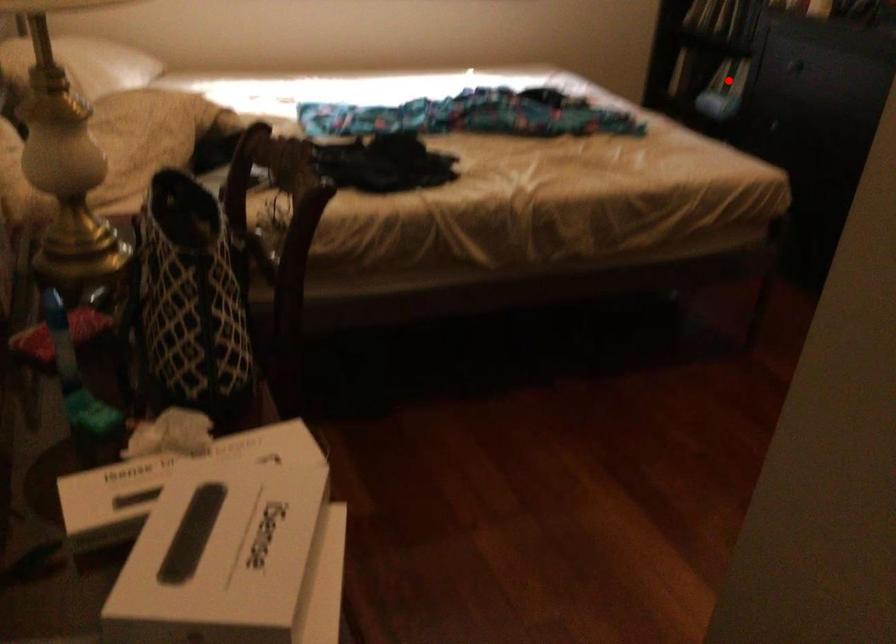
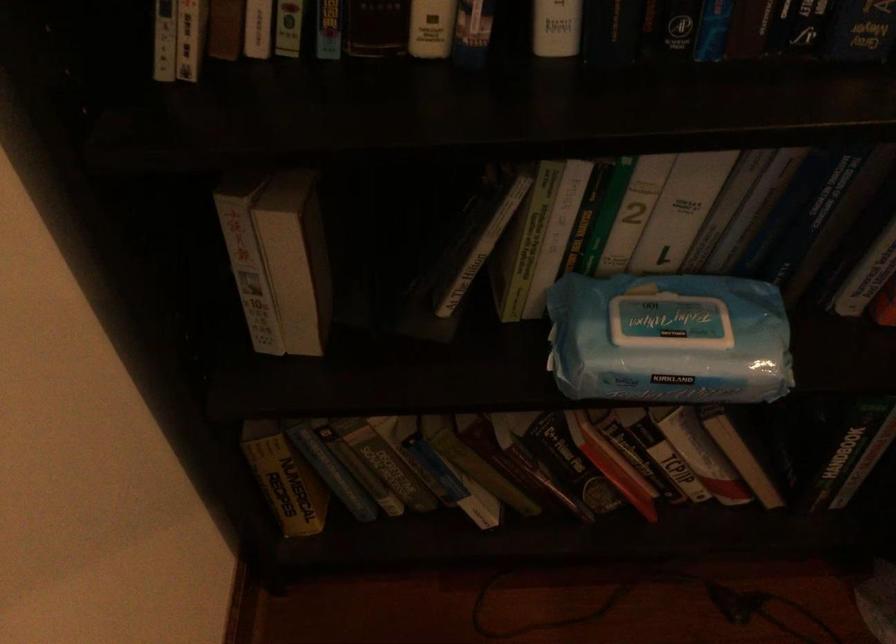
Question: I am providing you with two images of the same scene from different viewpoints. Image1 has a red point marked. In image2, the corresponding 3D location appears at what relative position? Reply with the corresponding letter.

Choices:
 (A) Closer
 (B) Farther

Answer: (A)